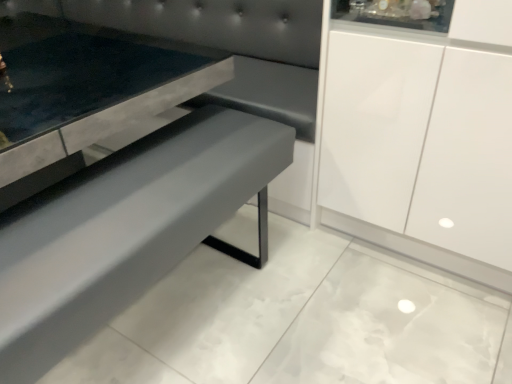
Question: Should I look upward or downward to see matte gray bench at center?

Choices:
 (A) up
 (B) down

Answer: (B)

Question: Can you confirm if suede-like gray couch at center is thinner than matte gray bench at center?

Choices:
 (A) no
 (B) yes

Answer: (A)

Question: Is suede-like gray couch at center surrounding matte gray bench at center?

Choices:
 (A) no
 (B) yes

Answer: (A)

Question: Could you tell me if suede-like gray couch at center is facing matte gray bench at center?

Choices:
 (A) no
 (B) yes

Answer: (B)

Question: Is suede-like gray couch at center oriented away from matte gray bench at center?

Choices:
 (A) yes
 (B) no

Answer: (B)

Question: From the image's perspective, would you say suede-like gray couch at center is positioned over matte gray bench at center?

Choices:
 (A) yes
 (B) no

Answer: (A)

Question: Is suede-like gray couch at center to the right of matte gray bench at center from the viewer's perspective?

Choices:
 (A) no
 (B) yes

Answer: (A)

Question: Is matte gray bench at center far away from suede-like gray couch at center?

Choices:
 (A) yes
 (B) no

Answer: (B)

Question: Considering the relative positions of matte gray bench at center and suede-like gray couch at center in the image provided, is matte gray bench at center to the right of suede-like gray couch at center from the viewer's perspective?

Choices:
 (A) no
 (B) yes

Answer: (B)

Question: Is the position of matte gray bench at center less distant than that of suede-like gray couch at center?

Choices:
 (A) no
 (B) yes

Answer: (B)

Question: Is matte gray bench at center facing away from suede-like gray couch at center?

Choices:
 (A) no
 (B) yes

Answer: (A)

Question: From the image's perspective, would you say matte gray bench at center is shown under suede-like gray couch at center?

Choices:
 (A) yes
 (B) no

Answer: (A)

Question: Is matte gray bench at center facing towards suede-like gray couch at center?

Choices:
 (A) yes
 (B) no

Answer: (A)

Question: Does point (204, 208) appear closer or farther from the camera than point (252, 8)?

Choices:
 (A) closer
 (B) farther

Answer: (A)